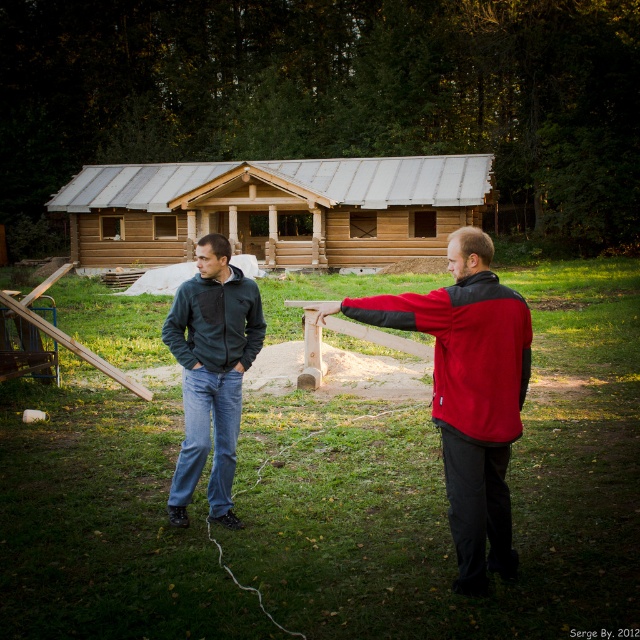
Question: Among these points, which one is farthest from the camera?

Choices:
 (A) (253, 282)
 (B) (328, 538)
 (C) (220, 547)
 (D) (312, 186)

Answer: (D)

Question: Can you confirm if wooden log cabin at center is positioned below white fabric string at lower center?

Choices:
 (A) yes
 (B) no

Answer: (B)

Question: Can you confirm if wooden log cabin at center is bigger than matte green jacket at center?

Choices:
 (A) no
 (B) yes

Answer: (B)

Question: Considering the relative positions of green grass at center and red fleece jacket at center in the image provided, where is green grass at center located with respect to red fleece jacket at center?

Choices:
 (A) above
 (B) below

Answer: (B)

Question: Among these objects, which one is farthest from the camera?

Choices:
 (A) matte green jacket at center
 (B) wooden log cabin at center
 (C) red fleece jacket at center

Answer: (B)

Question: Which is farther from the red fleece jacket at center?

Choices:
 (A) matte green jacket at center
 (B) white fabric string at lower center
 (C) wooden log cabin at center
 (D) green grass at center

Answer: (C)